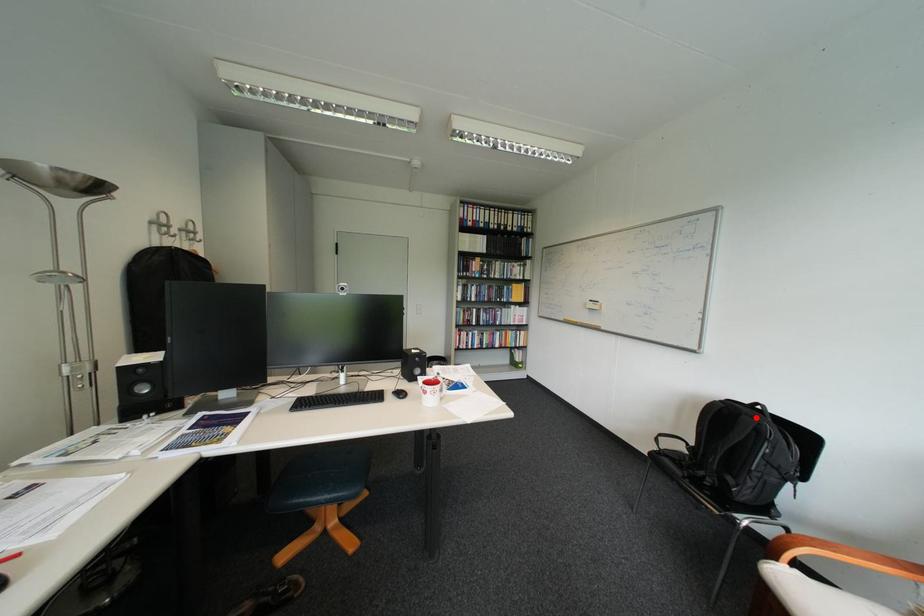
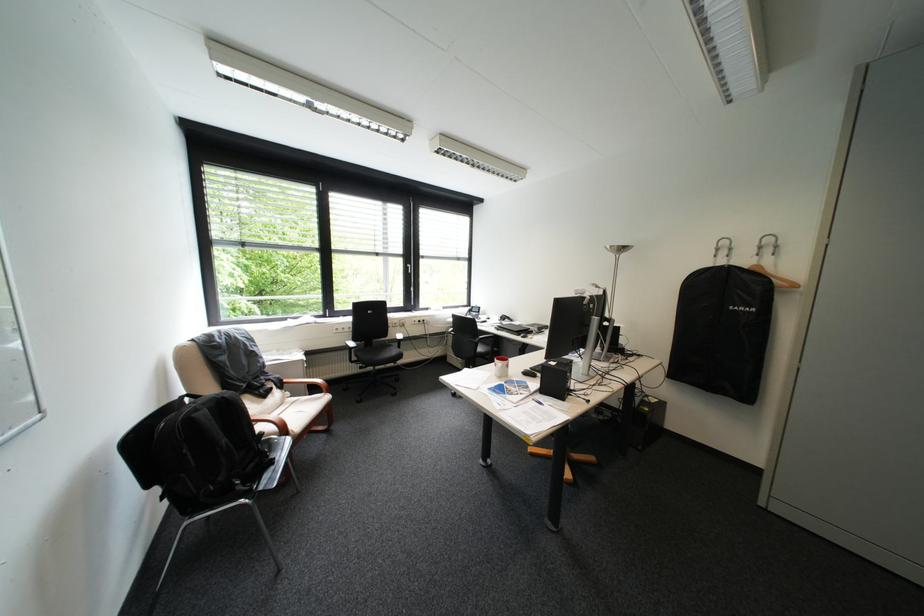
In the second image, find the point that corresponds to the highlighted location in the first image.

(236, 398)